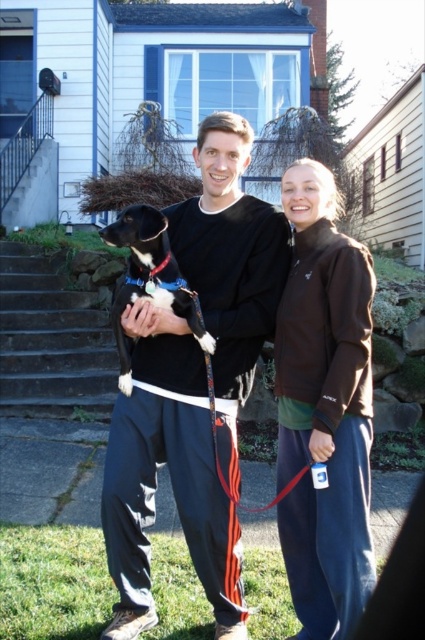
Which of these two, concrete stairs at lower left or black and white fur at center, stands taller?

Standing taller between the two is concrete stairs at lower left.

Which is more to the right, concrete stairs at lower left or black and white fur at center?

black and white fur at center

The image size is (425, 640). What do you see at coordinates (51, 340) in the screenshot? I see `concrete stairs at lower left` at bounding box center [51, 340].

This screenshot has height=640, width=425. What are the coordinates of `concrete stairs at lower left` in the screenshot? It's located at (51, 340).

Which is behind, point (132, 320) or point (45, 387)?

The point (45, 387) is more distant.

Is point (212, 120) farther from camera compared to point (14, 257)?

No, (212, 120) is in front of (14, 257).

Image resolution: width=425 pixels, height=640 pixels. What are the coordinates of `black matte dog at center` in the screenshot? It's located at (170, 476).

How distant is matte brown jacket at center from black and white fur at center?

The distance of matte brown jacket at center from black and white fur at center is 30.10 inches.

Does matte brown jacket at center have a greater height compared to black and white fur at center?

Indeed, matte brown jacket at center has a greater height compared to black and white fur at center.

Is point (346, 560) more distant than point (147, 241)?

No, (346, 560) is in front of (147, 241).

The image size is (425, 640). Find the location of `matte brown jacket at center`. matte brown jacket at center is located at coordinates (325, 408).